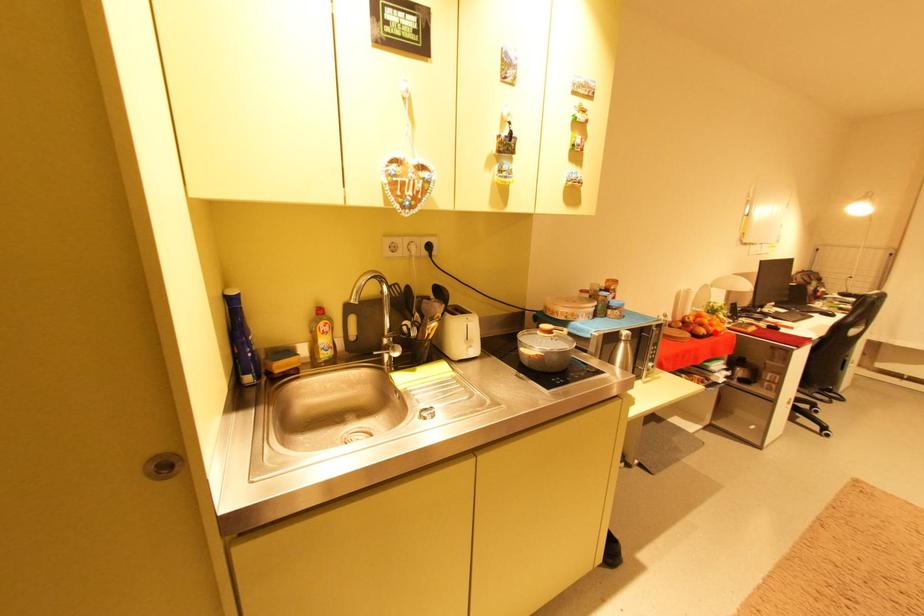
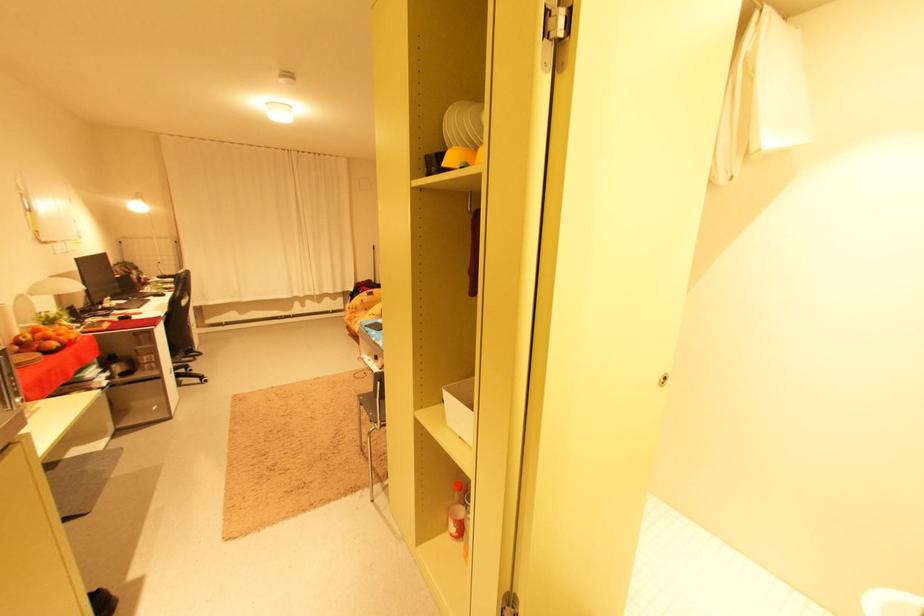
I am providing you with two images of the same scene from different viewpoints. A red point is marked on the first image and another point is marked on the second image. Are the points marked in image1 and image2 representing the same 3D position?

Yes